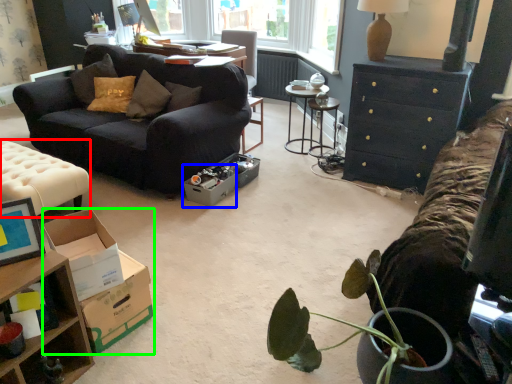
Question: Based on their relative distances, which object is nearer to table (highlighted by a red box)? Choose from cardboard box (highlighted by a blue box) and cardboard box (highlighted by a green box).

Choices:
 (A) cardboard box
 (B) cardboard box

Answer: (A)